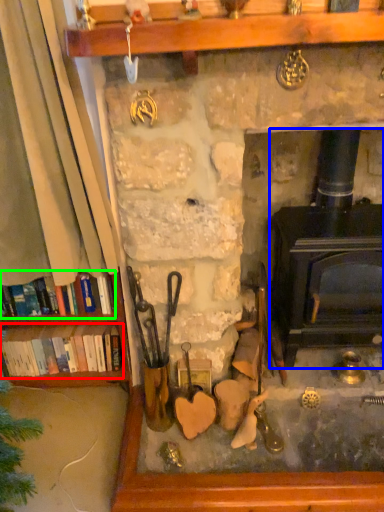
Question: Which object is the farthest from book (highlighted by a red box)? Choose among these: wood burning stove (highlighted by a blue box) or book (highlighted by a green box).

Choices:
 (A) wood burning stove
 (B) book

Answer: (A)